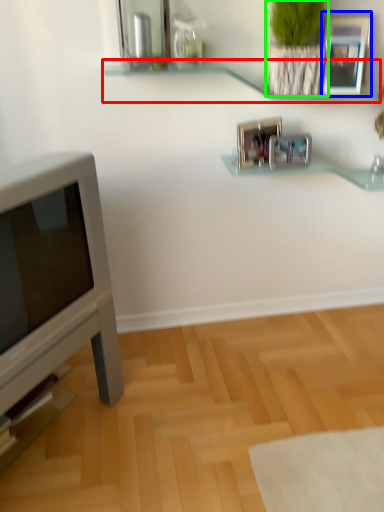
Question: Estimate the real-world distances between objects in this image. Which object is farther from shelf (highlighted by a red box), picture frame (highlighted by a blue box) or plant (highlighted by a green box)?

Choices:
 (A) picture frame
 (B) plant

Answer: (A)